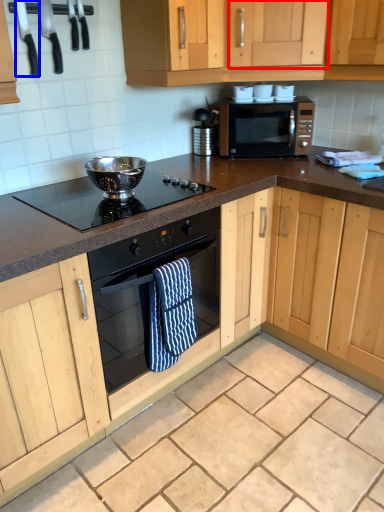
Question: Which of the following is the closest to the observer, cabinetry (highlighted by a red box) or appliance (highlighted by a blue box)?

Choices:
 (A) cabinetry
 (B) appliance

Answer: (B)